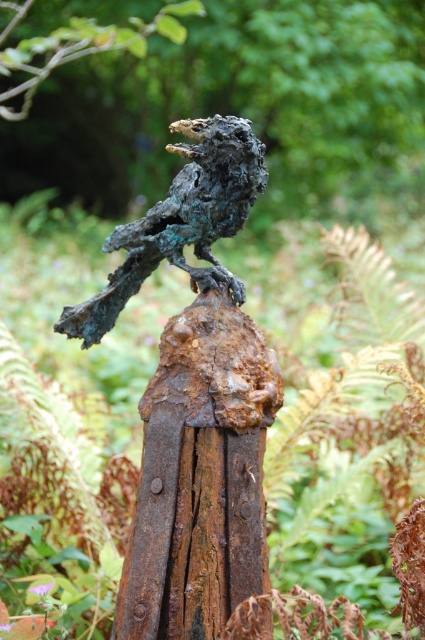
You are standing in front of the sculpture and want to touch both the rusty metal bird at upper center and the green patina bird at center. Which one will you need to reach higher to touch?

The rusty metal bird at upper center is located above the green patina bird at center, so you will need to reach higher to touch the rusty metal bird at upper center.

You are standing in front of the sculpture and want to take a photo of the rusty metal bird at upper center. Where should you aim your camera to capture the bird in the frame?

The rusty metal bird at upper center is located at the 2D coordinates point (232, 102), so aim your camera towards that point to capture it in the frame.